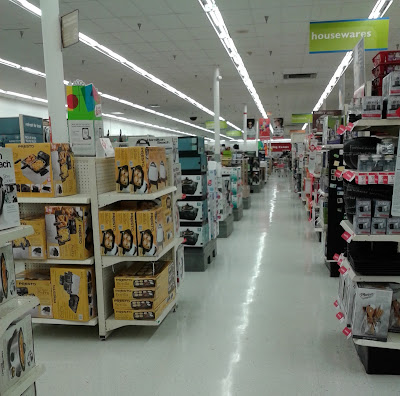
You are a GUI agent. You are given a task and a screenshot of the screen. Output one action in this format:
    pyautogui.click(x=<x>, y=<y>)
    Task: Click on the air conditioning vent
    This screenshot has height=396, width=400.
    Given the screenshot: What is the action you would take?
    coord(298,75)